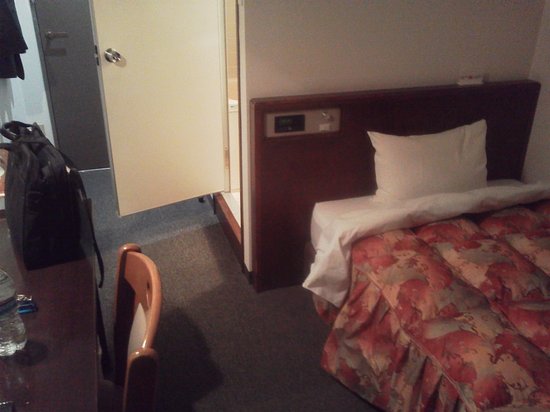
Identify the location of pillow. (437, 162).